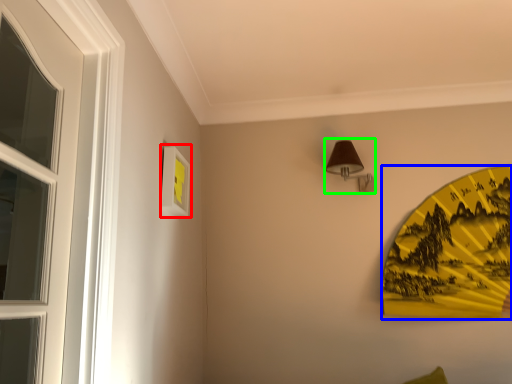
Question: Which object is positioned farthest from picture frame (highlighted by a red box)? Select from design (highlighted by a blue box) and lamp (highlighted by a green box).

Choices:
 (A) design
 (B) lamp

Answer: (A)